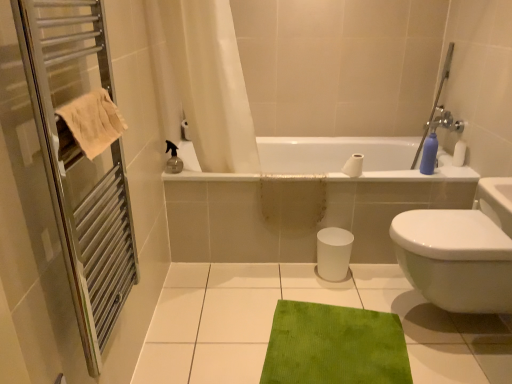
Question: Does white matte toilet paper at upper center have a lesser height compared to metal towel rack at left?

Choices:
 (A) yes
 (B) no

Answer: (A)

Question: Does white matte toilet paper at upper center come in front of metal towel rack at left?

Choices:
 (A) no
 (B) yes

Answer: (A)

Question: Is white matte toilet paper at upper center directly adjacent to metal towel rack at left?

Choices:
 (A) no
 (B) yes

Answer: (A)

Question: Is there a large distance between white matte toilet paper at upper center and metal towel rack at left?

Choices:
 (A) no
 (B) yes

Answer: (B)

Question: From a real-world perspective, is white matte toilet paper at upper center over metal towel rack at left?

Choices:
 (A) yes
 (B) no

Answer: (B)

Question: Is white matte toilet paper at upper center outside of metal towel rack at left?

Choices:
 (A) yes
 (B) no

Answer: (A)

Question: Can you confirm if metal towel rack at left is shorter than green textured mat at lower center?

Choices:
 (A) yes
 (B) no

Answer: (B)

Question: Is metal towel rack at left wider than green textured mat at lower center?

Choices:
 (A) yes
 (B) no

Answer: (B)

Question: From a real-world perspective, is metal towel rack at left physically below green textured mat at lower center?

Choices:
 (A) yes
 (B) no

Answer: (B)

Question: Can you confirm if metal towel rack at left is bigger than green textured mat at lower center?

Choices:
 (A) no
 (B) yes

Answer: (A)

Question: From the image's perspective, is metal towel rack at left over green textured mat at lower center?

Choices:
 (A) no
 (B) yes

Answer: (B)

Question: From the image's perspective, is metal towel rack at left located beneath green textured mat at lower center?

Choices:
 (A) yes
 (B) no

Answer: (B)

Question: Is green textured mat at lower center thinner than white glossy bathtub at center?

Choices:
 (A) yes
 (B) no

Answer: (B)